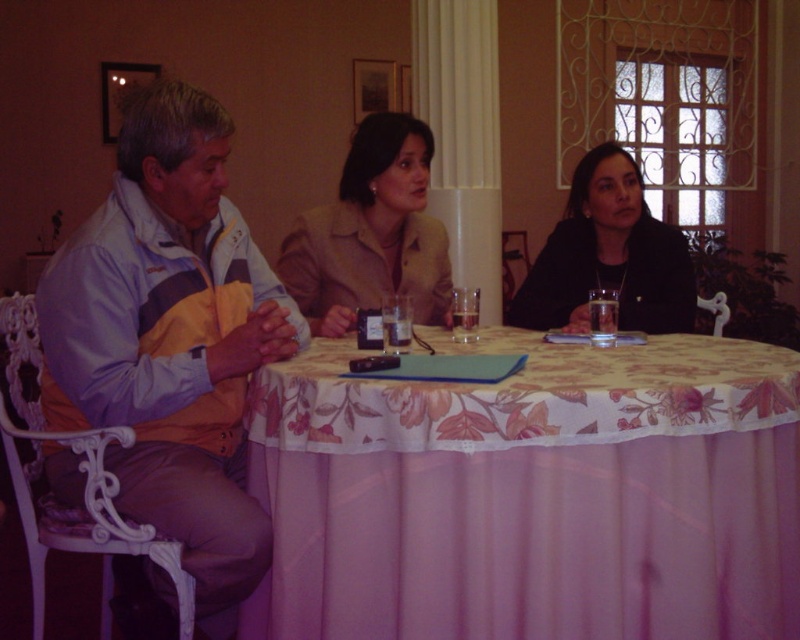
Question: Which is farther from the black matte jacket at upper right?

Choices:
 (A) light blue and yellow jacket at left
 (B) floral fabric tablecloth at center

Answer: (A)

Question: Which object is closer to the camera taking this photo?

Choices:
 (A) light blue and yellow jacket at left
 (B) floral fabric tablecloth at center
 (C) black matte jacket at upper right

Answer: (B)

Question: Does floral fabric tablecloth at center appear over black matte jacket at upper right?

Choices:
 (A) yes
 (B) no

Answer: (B)

Question: Which point is closer to the camera taking this photo?

Choices:
 (A) (248, 346)
 (B) (658, 312)

Answer: (A)

Question: Where is floral fabric tablecloth at center located in relation to beige fabric jacket at center in the image?

Choices:
 (A) left
 (B) right

Answer: (B)

Question: Does light blue and yellow jacket at left appear on the left side of black matte jacket at upper right?

Choices:
 (A) yes
 (B) no

Answer: (A)